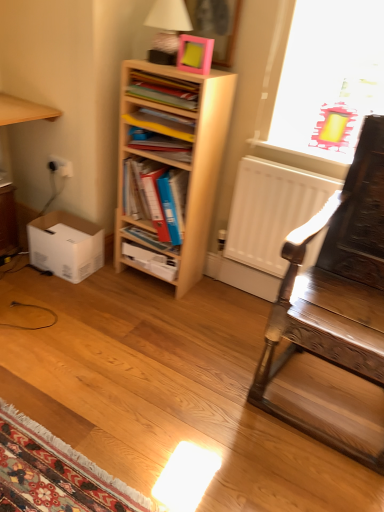
Where is `free space in front of white matte radiator at center`? free space in front of white matte radiator at center is located at coordinates (245, 331).